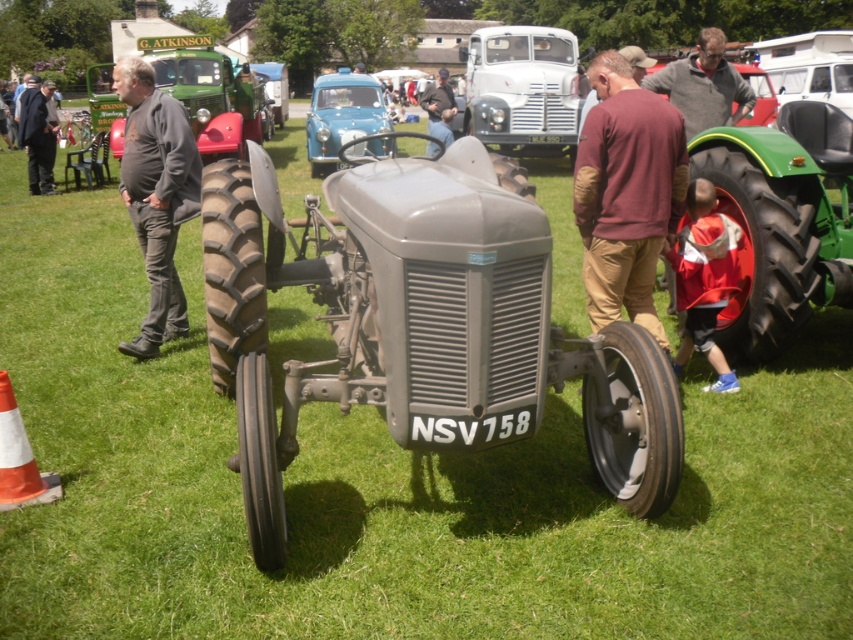
Question: Among these objects, which one is farthest from the camera?

Choices:
 (A) dark gray suit at left
 (B) gray fabric pants at left

Answer: (A)

Question: Is red jacket at center above dark gray fabric jacket at center?

Choices:
 (A) no
 (B) yes

Answer: (A)

Question: Estimate the real-world distances between objects in this image. Which object is closer to the dark gray suit at left?

Choices:
 (A) gray fabric pants at left
 (B) red jacket at center
 (C) dark gray fabric jacket at center

Answer: (C)

Question: Is gray fabric pants at left below dark gray suit at left?

Choices:
 (A) no
 (B) yes

Answer: (B)

Question: Can you confirm if maroon sweater at center is wider than dark gray fabric jacket at center?

Choices:
 (A) yes
 (B) no

Answer: (B)

Question: Among these points, which one is farthest from the camera?

Choices:
 (A) [x=428, y=148]
 (B) [x=593, y=136]

Answer: (A)